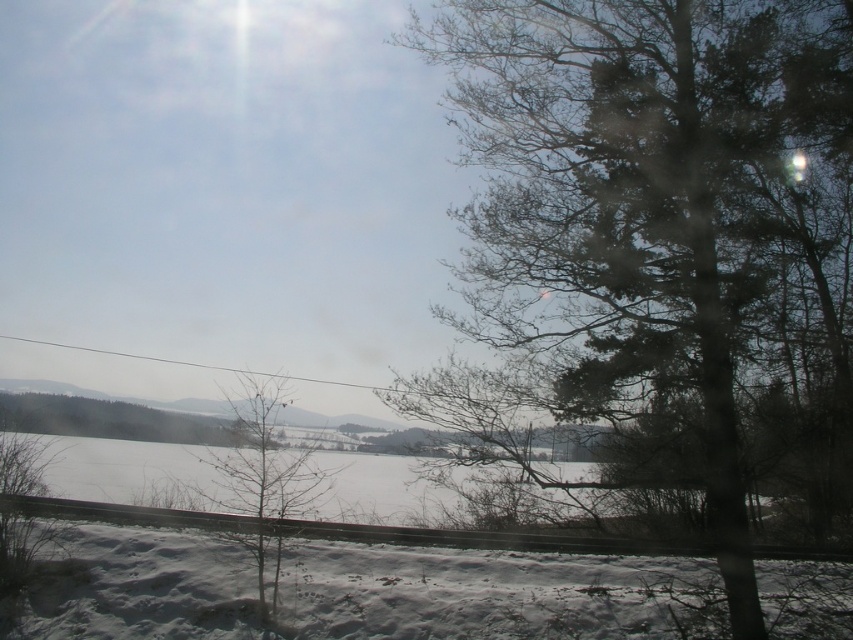
Describe the element at coordinates (135, 472) in the screenshot. I see `white snow at center` at that location.

Is the position of white snow at center less distant than that of bare branches at center?

Yes, it is in front of bare branches at center.

Is point (212, 474) farther from viewer compared to point (228, 500)?

That is True.

Where is `white snow at center`? The height and width of the screenshot is (640, 853). white snow at center is located at coordinates (135, 472).

How much distance is there between dark green textured tree at right and white fluffy snow at lower center?

A distance of 15.54 feet exists between dark green textured tree at right and white fluffy snow at lower center.

Find the location of a particular element. This screenshot has height=640, width=853. dark green textured tree at right is located at coordinates (664, 230).

Identify the location of dark green textured tree at right. The width and height of the screenshot is (853, 640). (664, 230).

Which is above, dark green textured tree at right or bare branches at center?

dark green textured tree at right is above.

Image resolution: width=853 pixels, height=640 pixels. What do you see at coordinates (664, 230) in the screenshot?
I see `dark green textured tree at right` at bounding box center [664, 230].

Describe the element at coordinates (664, 230) in the screenshot. I see `dark green textured tree at right` at that location.

At what (x,y) coordinates should I click in order to perform the action: click on dark green textured tree at right. Please return your answer as a coordinate pair (x, y). Looking at the image, I should click on (664, 230).